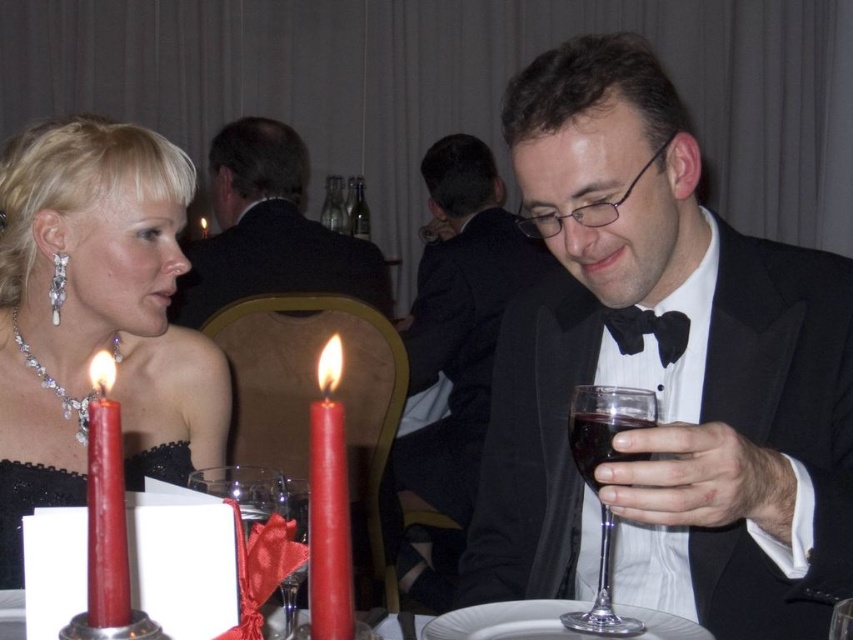
Question: Which object appears closest to the camera in this image?

Choices:
 (A) matte black suit at upper center
 (B) red wax candle at left

Answer: (B)

Question: Is black satin tuxedo at center closer to the viewer compared to red matte candle at left?

Choices:
 (A) yes
 (B) no

Answer: (B)

Question: Considering the real-world distances, which object is farthest from the black satin bow tie at center?

Choices:
 (A) transparent glass wine glass at center
 (B) black satin tuxedo at center
 (C) red matte candle at left

Answer: (C)

Question: Can you confirm if matte black suit at upper center is bigger than clear glass wine glass at center?

Choices:
 (A) no
 (B) yes

Answer: (B)

Question: Among these points, which one is nearest to the camera?

Choices:
 (A) (637, 621)
 (B) (283, 513)

Answer: (B)

Question: Is transparent glass wine glass at right to the left of transparent glass wine glass at center from the viewer's perspective?

Choices:
 (A) yes
 (B) no

Answer: (B)